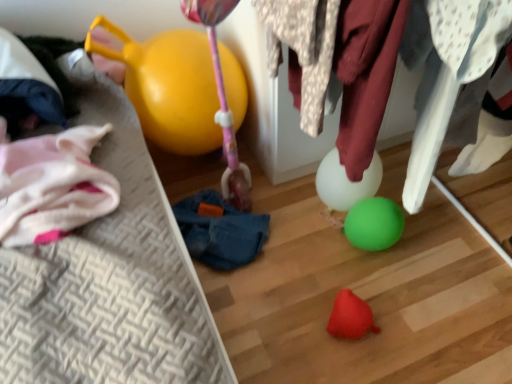
The height and width of the screenshot is (384, 512). I want to click on empty space that is in between blue fabric bean bag chair at center and rubber red toy at lower center, so click(x=286, y=279).